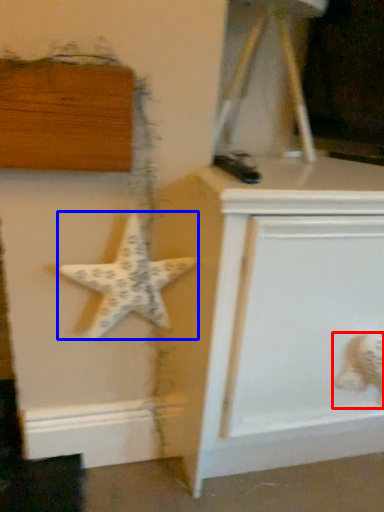
Question: Which of the following is the farthest to the observer, toy (highlighted by a red box) or starfish (highlighted by a blue box)?

Choices:
 (A) toy
 (B) starfish

Answer: (A)